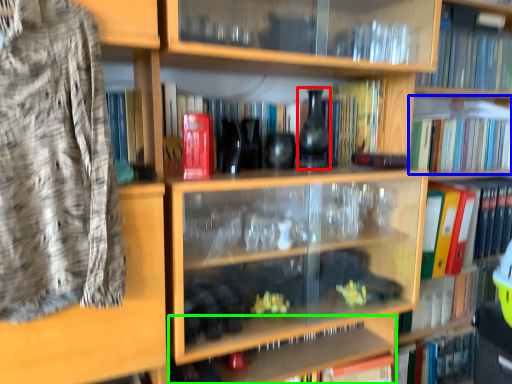
Question: Considering the real-world distances, which object is closest to glass vase (highlighted by a red box)? book (highlighted by a blue box) or cabinet (highlighted by a green box).

Choices:
 (A) book
 (B) cabinet

Answer: (B)